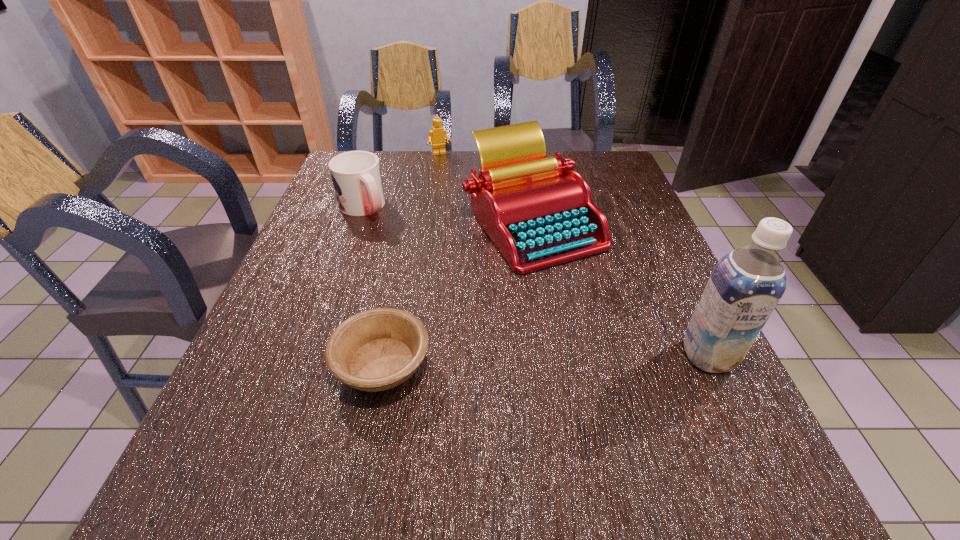
At what (x,y) coordinates should I click in order to perform the action: click on vacant spot on the desktop that is between the shortest object and the tallest object and is positioned on the face of the farthest object. Please return your answer as a coordinate pair (x, y). Looking at the image, I should click on (537, 360).

Image resolution: width=960 pixels, height=540 pixels. Identify the location of vacant space on the desktop that is between the bowl and the soya milk and is positioned on the typing side of the typewriter. (527, 360).

Locate an element on the screen. free spot on the desktop that is between the bowl and the tallest object and is positioned on the side of the mug with the handle is located at coordinates (503, 361).